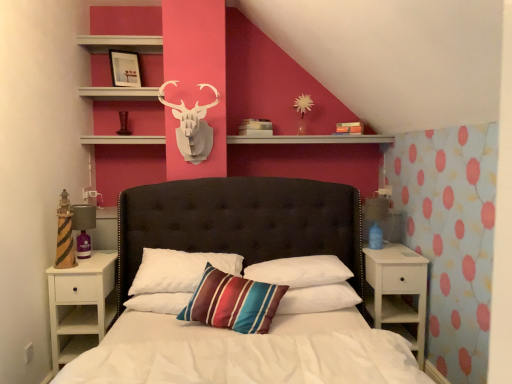
Question: Is striped fabric pillow at center, the 2th pillow positioned from the left, inside the boundaries of white matte shelf at upper center, or outside?

Choices:
 (A) outside
 (B) inside

Answer: (A)

Question: In terms of height, does striped fabric pillow at center, the 2th pillow positioned from the left, look taller or shorter compared to white matte shelf at upper center?

Choices:
 (A) short
 (B) tall

Answer: (B)

Question: Estimate the real-world distances between objects in this image. Which object is farther from the striped fabric pillow at center, the 2th pillow positioned from the left?

Choices:
 (A) tufted leather bed at center
 (B) matte black picture frame at upper center
 (C) white soft pillow at center, positioned as the 3th pillow in left-to-right order
 (D) white soft pillow at center, acting as the first pillow starting from the right
 (E) white matte shelf at upper center

Answer: (B)

Question: Considering the real-world distances, which object is closest to the tufted leather bed at center?

Choices:
 (A) striped fabric pillow at center, the 2th pillow positioned from the left
 (B) white matte nightstand at right, which is the 1th nightstand from right to left
 (C) white soft pillow at center, positioned as the 3th pillow in left-to-right order
 (D) white wood nightstand at lower left, the 1th nightstand when ordered from left to right
 (E) matte black picture frame at upper center

Answer: (C)